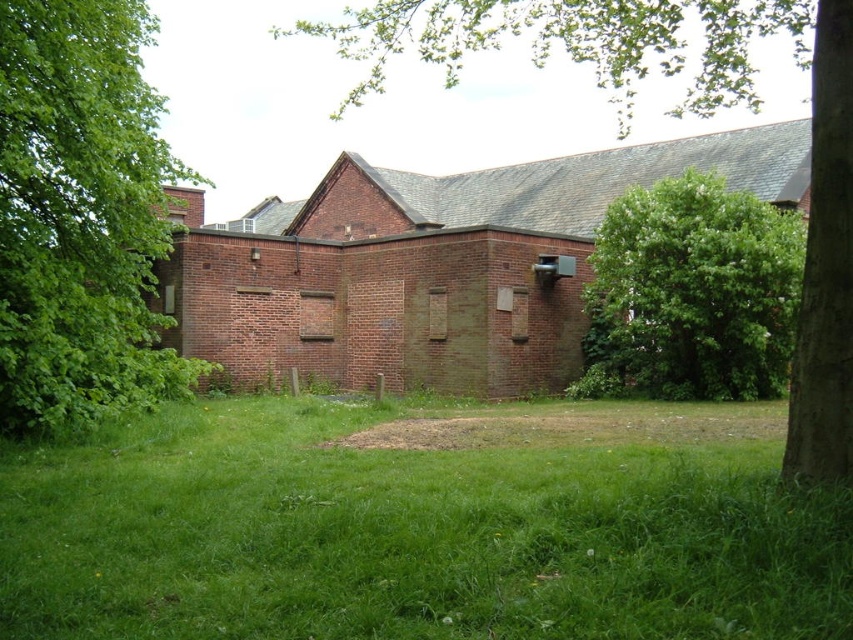
Does green grass at center appear on the right side of green leafy tree at right?

In fact, green grass at center is to the left of green leafy tree at right.

Can you confirm if green grass at center is positioned above green leafy tree at right?

No, green grass at center is not above green leafy tree at right.

What do you see at coordinates (422, 525) in the screenshot? The image size is (853, 640). I see `green grass at center` at bounding box center [422, 525].

The image size is (853, 640). Identify the location of green grass at center. (422, 525).

Does green grass at center have a smaller size compared to green leafy tree at left?

Correct, green grass at center occupies less space than green leafy tree at left.

Can you confirm if green grass at center is positioned below green leafy tree at left?

Indeed, green grass at center is positioned under green leafy tree at left.

Is point (117, 474) behind point (70, 408)?

No, (117, 474) is in front of (70, 408).

You are a GUI agent. You are given a task and a screenshot of the screen. Output one action in this format:
    pyautogui.click(x=<x>, y=<y>)
    Task: Click on the green grass at center
    
    Given the screenshot: What is the action you would take?
    pyautogui.click(x=422, y=525)

Which is more to the right, green grass at center or green leafy tree at center?

From the viewer's perspective, green leafy tree at center appears more on the right side.

Can you confirm if green grass at center is positioned below green leafy tree at center?

Indeed, green grass at center is positioned under green leafy tree at center.

Is point (219, 634) positioned behind point (814, 262)?

No, it is in front of (814, 262).

Locate an element on the screen. green grass at center is located at coordinates (422, 525).